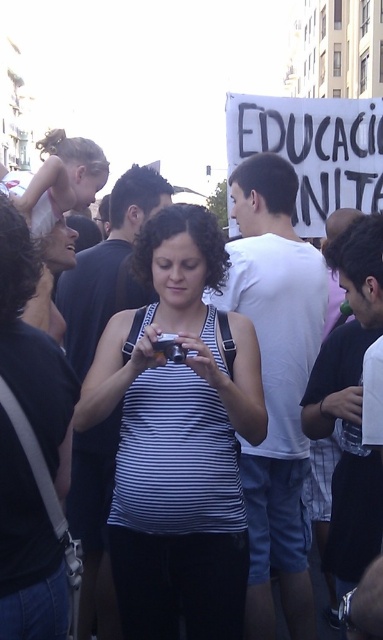
Locate an element on the screen. white striped tank top at center is located at coordinates (178, 440).

Describe the element at coordinates (178, 440) in the screenshot. The image size is (383, 640). I see `white striped tank top at center` at that location.

Image resolution: width=383 pixels, height=640 pixels. I want to click on white striped tank top at center, so click(x=178, y=440).